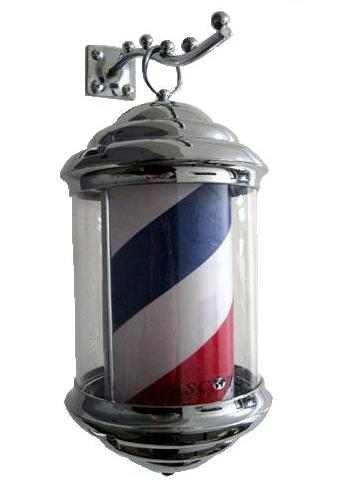
At what (x,y) coordinates should I click in order to perform the action: click on hook. Please return your answer as a coordinate pair (x, y). The height and width of the screenshot is (497, 358). Looking at the image, I should click on (151, 86).